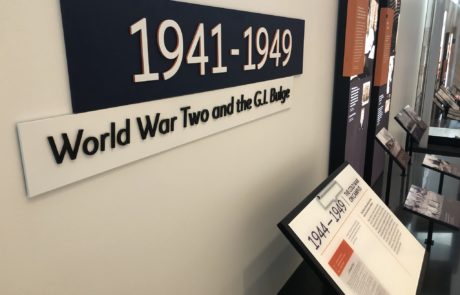
This screenshot has width=460, height=295. I want to click on white document on easel on tabletop, bottom right, so click(373, 259).